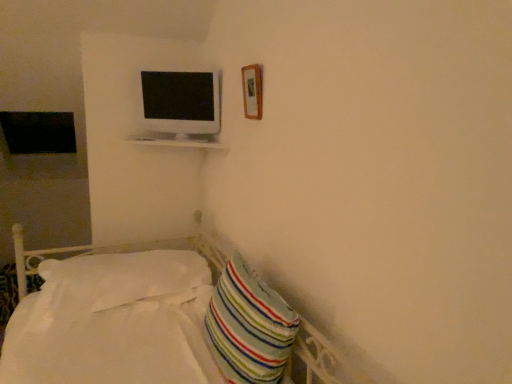
Question: Is wooden frame at upper right to the left of striped fabric pillow at lower right, marked as the second pillow in a left-to-right arrangement, from the viewer's perspective?

Choices:
 (A) yes
 (B) no

Answer: (B)

Question: Is wooden frame at upper right smaller than striped fabric pillow at lower right, the second pillow when ordered from back to front?

Choices:
 (A) yes
 (B) no

Answer: (A)

Question: Can you confirm if wooden frame at upper right is positioned to the right of striped fabric pillow at lower right, the second pillow when ordered from back to front?

Choices:
 (A) no
 (B) yes

Answer: (B)

Question: Can you confirm if wooden frame at upper right is bigger than striped fabric pillow at lower right, marked as the second pillow in a left-to-right arrangement?

Choices:
 (A) yes
 (B) no

Answer: (B)

Question: From the image's perspective, is wooden frame at upper right below striped fabric pillow at lower right, marked as the second pillow in a left-to-right arrangement?

Choices:
 (A) yes
 (B) no

Answer: (B)

Question: Based on their sizes in the image, would you say wooden frame at upper right is bigger or smaller than white soft pillow at lower left, marked as the 1th pillow in a back-to-front arrangement?

Choices:
 (A) big
 (B) small

Answer: (B)

Question: Choose the correct answer: Is wooden frame at upper right inside white soft pillow at lower left, positioned as the second pillow in front-to-back order, or outside it?

Choices:
 (A) outside
 (B) inside

Answer: (A)

Question: From a real-world perspective, is wooden frame at upper right positioned above or below white soft pillow at lower left, positioned as the second pillow in front-to-back order?

Choices:
 (A) below
 (B) above

Answer: (B)

Question: Would you say wooden frame at upper right is to the left or to the right of white soft pillow at lower left, the second pillow when ordered from right to left, in the picture?

Choices:
 (A) left
 (B) right

Answer: (B)

Question: Is wooden frame at upper right in front of or behind white glossy monitor at upper center in the image?

Choices:
 (A) front
 (B) behind

Answer: (A)

Question: Does point (257, 112) appear closer or farther from the camera than point (181, 92)?

Choices:
 (A) farther
 (B) closer

Answer: (B)

Question: From a real-world perspective, is wooden frame at upper right positioned above or below white glossy monitor at upper center?

Choices:
 (A) below
 (B) above

Answer: (B)

Question: In terms of height, does wooden frame at upper right look taller or shorter compared to white glossy monitor at upper center?

Choices:
 (A) tall
 (B) short

Answer: (B)

Question: Considering the relative positions of white soft pillow at lower left, placed as the first pillow when sorted from left to right, and striped fabric pillow at lower right, the second pillow when ordered from back to front, in the image provided, is white soft pillow at lower left, placed as the first pillow when sorted from left to right, to the left or to the right of striped fabric pillow at lower right, the second pillow when ordered from back to front,?

Choices:
 (A) left
 (B) right

Answer: (A)

Question: Considering the positions of white soft pillow at lower left, placed as the first pillow when sorted from left to right, and striped fabric pillow at lower right, marked as the second pillow in a left-to-right arrangement, in the image, is white soft pillow at lower left, placed as the first pillow when sorted from left to right, bigger or smaller than striped fabric pillow at lower right, marked as the second pillow in a left-to-right arrangement,?

Choices:
 (A) small
 (B) big

Answer: (B)